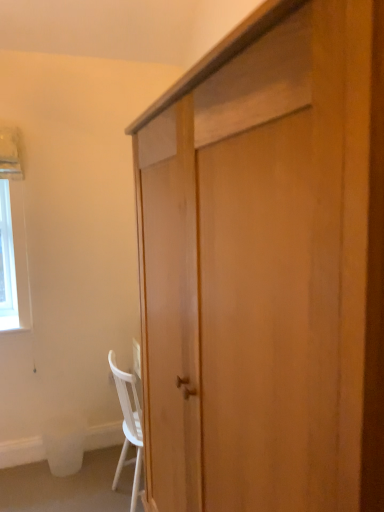
Question: Should I look upward or downward to see white matte chair at lower left?

Choices:
 (A) down
 (B) up

Answer: (A)

Question: From a real-world perspective, is white plastic trash bin at lower left positioned under white matte chair at lower left based on gravity?

Choices:
 (A) no
 (B) yes

Answer: (B)

Question: Is white plastic trash bin at lower left in front of white matte chair at lower left?

Choices:
 (A) no
 (B) yes

Answer: (A)

Question: Is white plastic trash bin at lower left at the left side of white matte chair at lower left?

Choices:
 (A) no
 (B) yes

Answer: (B)

Question: Is white plastic trash bin at lower left taller than white matte chair at lower left?

Choices:
 (A) no
 (B) yes

Answer: (A)

Question: Is white plastic trash bin at lower left completely or partially outside of white matte chair at lower left?

Choices:
 (A) yes
 (B) no

Answer: (A)

Question: Would you consider white plastic trash bin at lower left to be distant from white matte chair at lower left?

Choices:
 (A) yes
 (B) no

Answer: (B)

Question: Is light wood cabinet at center looking in the opposite direction of white matte chair at lower left?

Choices:
 (A) no
 (B) yes

Answer: (A)

Question: Is light wood cabinet at center thinner than white matte chair at lower left?

Choices:
 (A) no
 (B) yes

Answer: (A)

Question: Can white matte chair at lower left be found inside light wood cabinet at center?

Choices:
 (A) yes
 (B) no

Answer: (B)

Question: Is light wood cabinet at center beside white matte chair at lower left?

Choices:
 (A) yes
 (B) no

Answer: (B)

Question: Is light wood cabinet at center further to the viewer compared to white matte chair at lower left?

Choices:
 (A) yes
 (B) no

Answer: (B)

Question: From the image's perspective, does light wood cabinet at center appear lower than white matte chair at lower left?

Choices:
 (A) no
 (B) yes

Answer: (A)

Question: From the image's perspective, does light wood cabinet at center appear higher than white plastic trash bin at lower left?

Choices:
 (A) no
 (B) yes

Answer: (B)